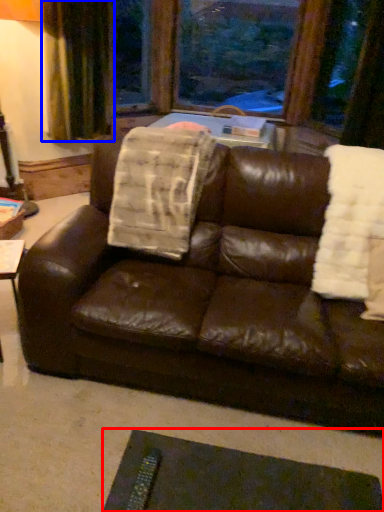
Question: Among these objects, which one is nearest to the camera, flat (highlighted by a red box) or curtain (highlighted by a blue box)?

Choices:
 (A) flat
 (B) curtain

Answer: (A)